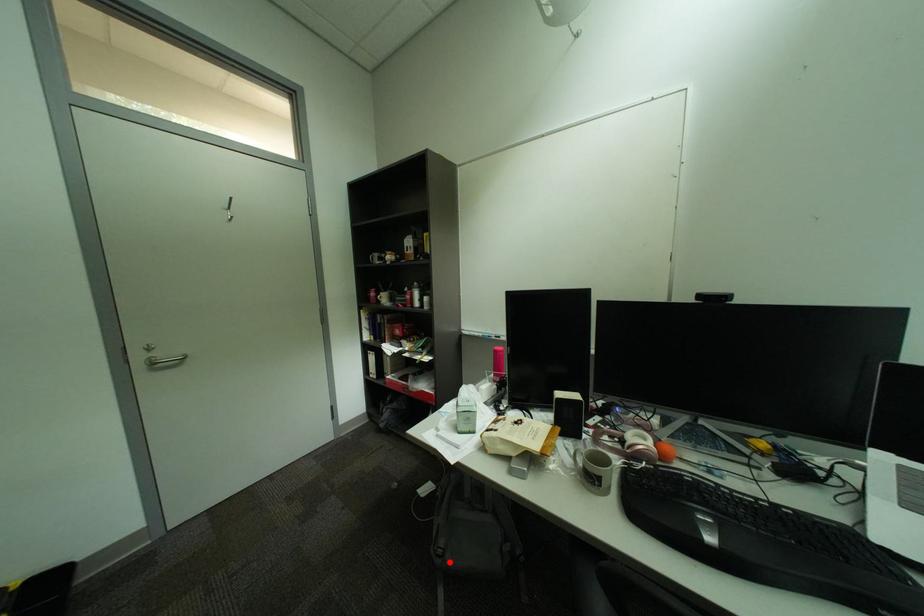
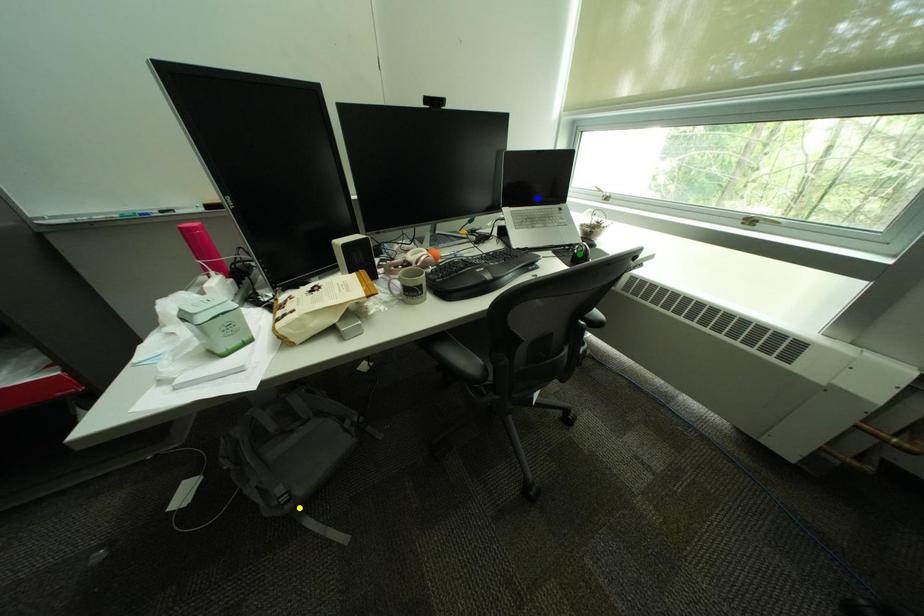
Question: I am providing you with two images of the same scene from different viewpoints. A red point is marked on the first image. You are given multiple points on the second image. Which mark in image 2 goes with the point in image 1?

Choices:
 (A) green point
 (B) blue point
 (C) yellow point

Answer: (C)